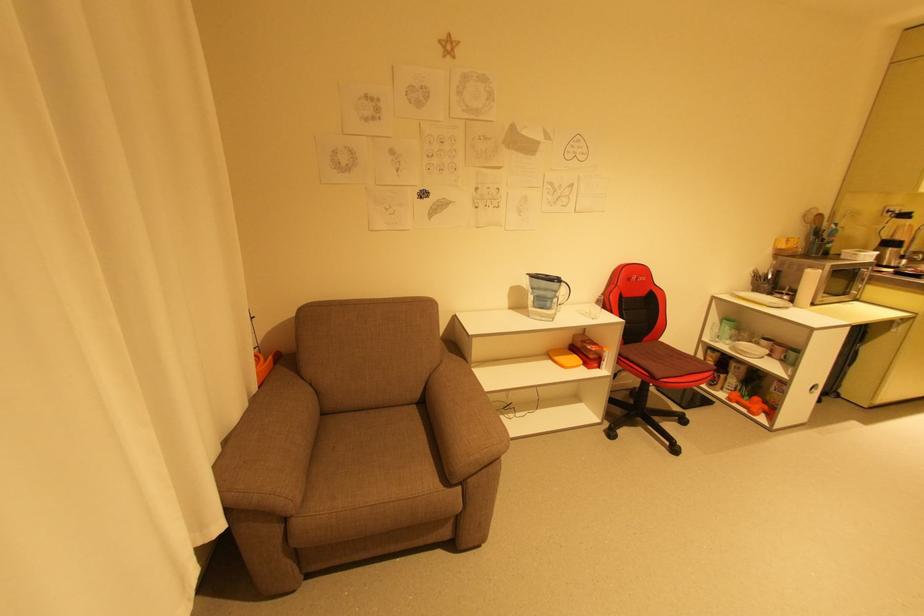
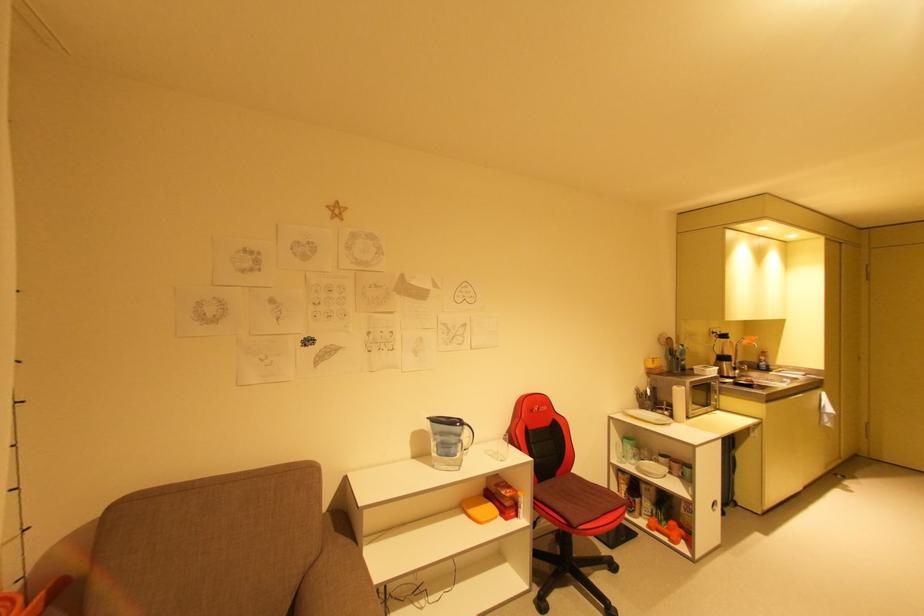
Find the pixel in the second image that matches the point at 757,410 in the first image.

(675, 538)